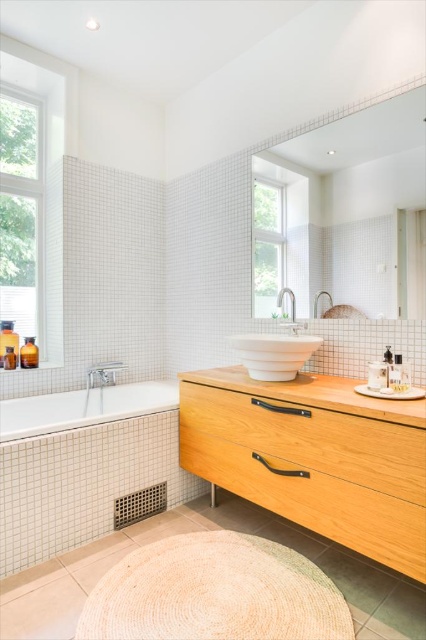
You are designing a layout for a bathroom and need to place a large mirror. The mirror requires a surface that can accommodate its size. Based on the image, which object between the light wood vanity at lower right and the white glossy sink at center would be a better choice for mounting the mirror?

The light wood vanity at lower right has a larger size compared to the white glossy sink at center, so it would be a better choice for mounting the large mirror as it can provide more space to accommodate the mirror.

Based on the photo, you are standing in the bathroom and want to reach the light wood vanity at lower right to place your keys on it. Considering you can comfortably reach up to 2.5 feet from your current position, can you reach the vanity without moving closer?

The light wood vanity at lower right is 4.83 feet away from you. Since your comfortable reach is only 2.5 feet, you cannot reach the vanity without moving closer.

You are designing a bathroom layout and need to place a large mirror. The mirror requires a surface that can support its weight. Which object between the light wood vanity at lower right and the clear glass window at upper left would be more suitable for mounting the mirror?

The light wood vanity at lower right is larger in size than the clear glass window at upper left, making it a more suitable surface for mounting the mirror as it can provide better support due to its size and structural integrity.